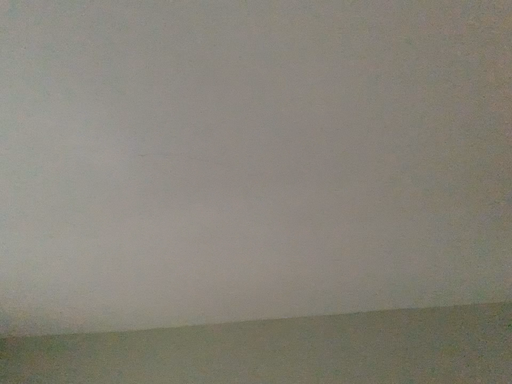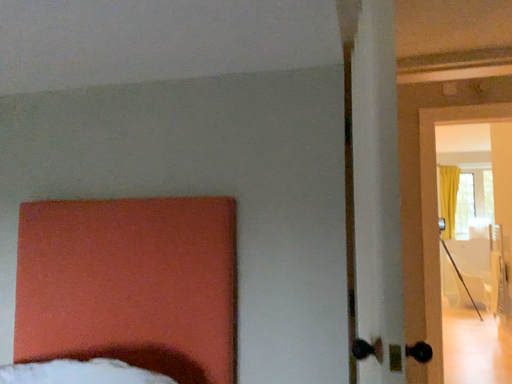
Question: Which way did the camera rotate in the video?

Choices:
 (A) rotated downward
 (B) rotated upward

Answer: (A)